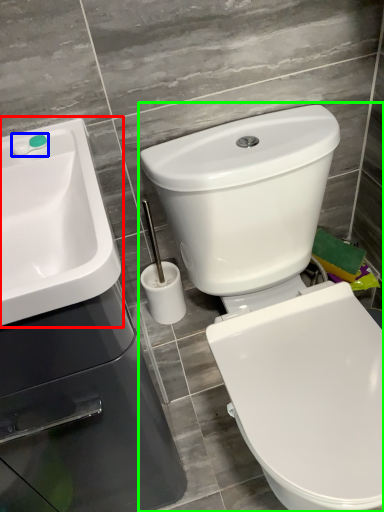
Question: Estimate the real-world distances between objects in this image. Which object is farther from sink (highlighted by a red box), plumbing fixture (highlighted by a blue box) or toilet (highlighted by a green box)?

Choices:
 (A) plumbing fixture
 (B) toilet

Answer: (B)